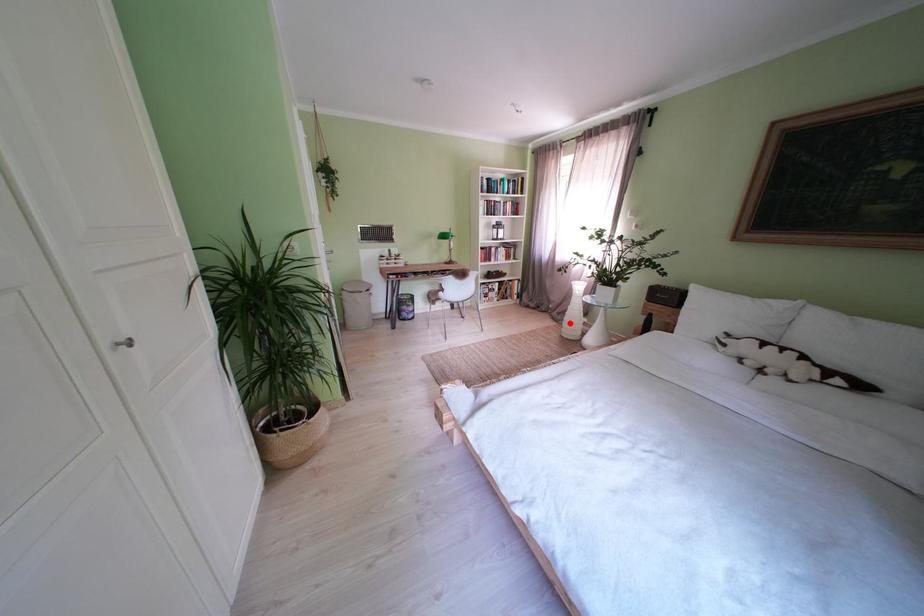
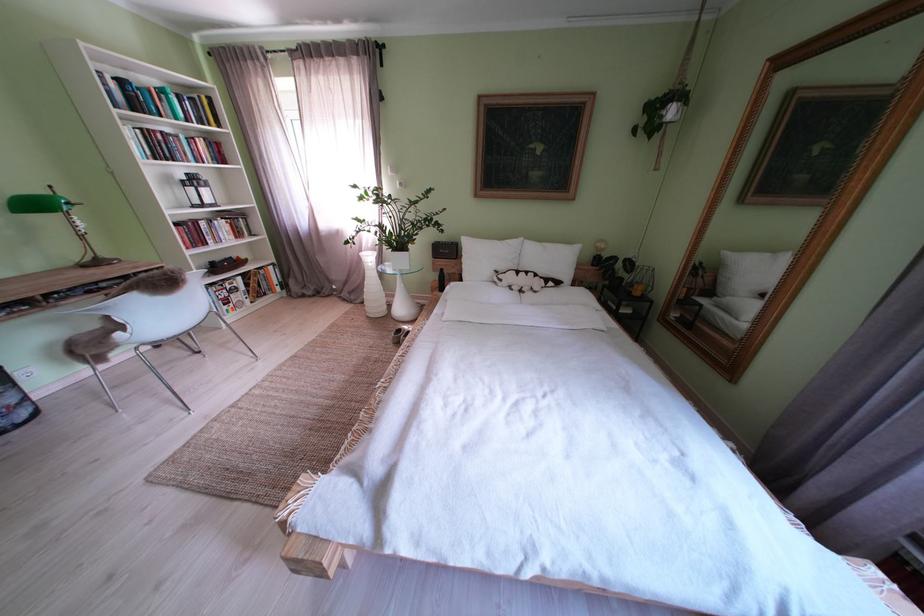
Question: I am providing you with two images of the same scene from different viewpoints. A red point is shown in image1. For the corresponding object point in image2, is it positioned nearer or farther from the camera?

Choices:
 (A) Nearer
 (B) Farther

Answer: (B)